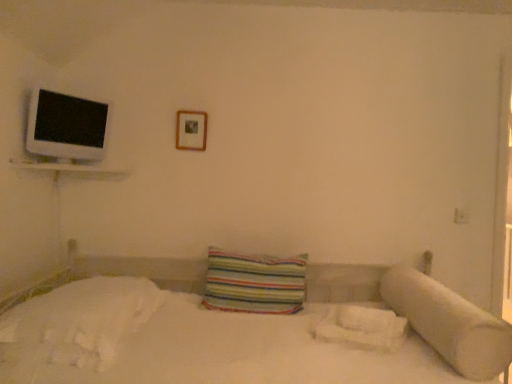
This screenshot has height=384, width=512. Find the location of `striped fabric pillow at center, the 1th pillow when ordered from left to right`. striped fabric pillow at center, the 1th pillow when ordered from left to right is located at coordinates (254, 283).

The height and width of the screenshot is (384, 512). What do you see at coordinates (254, 283) in the screenshot?
I see `striped fabric pillow at center, which is the 2th pillow in right-to-left order` at bounding box center [254, 283].

Where is `white soft bedsheet at lower left, the 1th sheet from the left`? The height and width of the screenshot is (384, 512). white soft bedsheet at lower left, the 1th sheet from the left is located at coordinates (76, 325).

Where is `white fluffy sheet at lower right, arranged as the first sheet when viewed from the right`? white fluffy sheet at lower right, arranged as the first sheet when viewed from the right is located at coordinates (362, 327).

Does point (62, 110) appear closer or farther from the camera than point (344, 326)?

Point (62, 110) appears to be farther away from the viewer than point (344, 326).

Which object is wider, white glossy flat at upper left or white fluffy sheet at lower right, arranged as the first sheet when viewed from the right?

white fluffy sheet at lower right, arranged as the first sheet when viewed from the right.

Looking at this image, from a real-world perspective, between white glossy flat at upper left and white fluffy sheet at lower right, the second sheet from the left, who is vertically higher?

From a 3D spatial view, white glossy flat at upper left is above.

Is white glossy flat at upper left aimed at white fluffy sheet at lower right, the second sheet from the left?

No, white glossy flat at upper left does not turn towards white fluffy sheet at lower right, the second sheet from the left.

In the image, is white fluffy sheet at lower right, arranged as the first sheet when viewed from the right, positioned in front of or behind white soft bedsheet at lower left, arranged as the 2th sheet when viewed from the right?

Visually, white fluffy sheet at lower right, arranged as the first sheet when viewed from the right, is located behind white soft bedsheet at lower left, arranged as the 2th sheet when viewed from the right.

From the image's perspective, which one is positioned lower, white fluffy sheet at lower right, the second sheet from the left, or white soft bedsheet at lower left, the 1th sheet from the left?

white fluffy sheet at lower right, the second sheet from the left, appears lower in the image.

Measure the distance from white fluffy sheet at lower right, the second sheet from the left, to white soft bedsheet at lower left, arranged as the 2th sheet when viewed from the right.

white fluffy sheet at lower right, the second sheet from the left, and white soft bedsheet at lower left, arranged as the 2th sheet when viewed from the right, are 3.38 feet apart.

Does white fluffy sheet at lower right, the second sheet from the left, have a smaller size compared to white soft bedsheet at lower left, arranged as the 2th sheet when viewed from the right?

Correct, white fluffy sheet at lower right, the second sheet from the left, occupies less space than white soft bedsheet at lower left, arranged as the 2th sheet when viewed from the right.

Considering the sizes of objects striped fabric pillow at center, the 1th pillow when ordered from left to right, and white soft bedsheet at lower left, arranged as the 2th sheet when viewed from the right, in the image provided, who is taller, striped fabric pillow at center, the 1th pillow when ordered from left to right, or white soft bedsheet at lower left, arranged as the 2th sheet when viewed from the right,?

striped fabric pillow at center, the 1th pillow when ordered from left to right, is taller.

Is striped fabric pillow at center, the 1th pillow when ordered from left to right, situated inside white soft bedsheet at lower left, arranged as the 2th sheet when viewed from the right, or outside?

The correct answer is: outside.

From the image's perspective, is striped fabric pillow at center, which is the 2th pillow in right-to-left order, located above white soft bedsheet at lower left, the 1th sheet from the left?

Indeed, from the image's perspective, striped fabric pillow at center, which is the 2th pillow in right-to-left order, is shown above white soft bedsheet at lower left, the 1th sheet from the left.

From a real-world perspective, between striped fabric pillow at center, which is the 2th pillow in right-to-left order, and white soft bedsheet at lower left, arranged as the 2th sheet when viewed from the right, who is vertically higher?

striped fabric pillow at center, which is the 2th pillow in right-to-left order, is physically above.

Can we say wooden picture frame at upper center lies outside white fluffy sheet at lower right, the second sheet from the left?

Yes, wooden picture frame at upper center is located beyond the bounds of white fluffy sheet at lower right, the second sheet from the left.

Is point (197, 112) more distant than point (370, 345)?

Yes, point (197, 112) is behind point (370, 345).

Are wooden picture frame at upper center and white fluffy sheet at lower right, arranged as the first sheet when viewed from the right, beside each other?

No, wooden picture frame at upper center is not with white fluffy sheet at lower right, arranged as the first sheet when viewed from the right.

Consider the image. Between wooden picture frame at upper center and white fluffy sheet at lower right, the second sheet from the left, which one has smaller size?

With smaller size is wooden picture frame at upper center.

At what (x,y) coordinates should I click in order to perform the action: click on picture frame to the right of white soft bedsheet at lower left, arranged as the 2th sheet when viewed from the right. Please return your answer as a coordinate pair (x, y). The width and height of the screenshot is (512, 384). Looking at the image, I should click on (191, 130).

Is there a large distance between white soft bedsheet at lower left, the 1th sheet from the left, and wooden picture frame at upper center?

white soft bedsheet at lower left, the 1th sheet from the left, is far away from wooden picture frame at upper center.

Does white soft bedsheet at lower left, the 1th sheet from the left, have a smaller size compared to wooden picture frame at upper center?

Actually, white soft bedsheet at lower left, the 1th sheet from the left, might be larger than wooden picture frame at upper center.

Who is smaller, white soft bedsheet at lower left, the 1th sheet from the left, or white soft pillow at right, arranged as the 1th pillow when viewed from the right?

white soft pillow at right, arranged as the 1th pillow when viewed from the right, is smaller.

Considering the positions of objects white soft bedsheet at lower left, the 1th sheet from the left, and white soft pillow at right, the 2th pillow in the left-to-right sequence, in the image provided, who is behind, white soft bedsheet at lower left, the 1th sheet from the left, or white soft pillow at right, the 2th pillow in the left-to-right sequence,?

white soft bedsheet at lower left, the 1th sheet from the left, is more distant.

From a real-world perspective, is white soft bedsheet at lower left, the 1th sheet from the left, physically located above or below white soft pillow at right, arranged as the 1th pillow when viewed from the right?

Clearly, from a real-world perspective, white soft bedsheet at lower left, the 1th sheet from the left, is below white soft pillow at right, arranged as the 1th pillow when viewed from the right.

Considering the sizes of white fluffy sheet at lower right, the second sheet from the left, and white soft pillow at right, arranged as the 1th pillow when viewed from the right, in the image, is white fluffy sheet at lower right, the second sheet from the left, bigger or smaller than white soft pillow at right, arranged as the 1th pillow when viewed from the right,?

In the image, white fluffy sheet at lower right, the second sheet from the left, appears to be smaller than white soft pillow at right, arranged as the 1th pillow when viewed from the right.

Is white fluffy sheet at lower right, arranged as the first sheet when viewed from the right, facing towards white soft pillow at right, arranged as the 1th pillow when viewed from the right?

No, white fluffy sheet at lower right, arranged as the first sheet when viewed from the right, is not facing towards white soft pillow at right, arranged as the 1th pillow when viewed from the right.

Considering the positions of point (378, 346) and point (444, 292), is point (378, 346) closer or farther from the camera than point (444, 292)?

Point (378, 346).

The width and height of the screenshot is (512, 384). Identify the location of flat above the white fluffy sheet at lower right, the second sheet from the left (from the image's perspective). (66, 126).

This screenshot has height=384, width=512. Identify the location of sheet located above the white fluffy sheet at lower right, arranged as the first sheet when viewed from the right (from a real-world perspective). (76, 325).

Estimate the real-world distances between objects in this image. Which object is closer to white soft bedsheet at lower left, arranged as the 2th sheet when viewed from the right, white glossy flat at upper left or striped fabric pillow at center, the 1th pillow when ordered from left to right?

striped fabric pillow at center, the 1th pillow when ordered from left to right, is positioned closer to the anchor white soft bedsheet at lower left, arranged as the 2th sheet when viewed from the right.

When comparing their distances from white soft pillow at right, arranged as the 1th pillow when viewed from the right, does striped fabric pillow at center, which is the 2th pillow in right-to-left order, or white soft bedsheet at lower left, the 1th sheet from the left, seem closer?

Based on the image, striped fabric pillow at center, which is the 2th pillow in right-to-left order, appears to be nearer to white soft pillow at right, arranged as the 1th pillow when viewed from the right.

Considering their positions, is white soft pillow at right, the 2th pillow in the left-to-right sequence, positioned closer to striped fabric pillow at center, which is the 2th pillow in right-to-left order, than wooden picture frame at upper center?

white soft pillow at right, the 2th pillow in the left-to-right sequence, is positioned closer to the anchor striped fabric pillow at center, which is the 2th pillow in right-to-left order.

Based on their spatial positions, is white fluffy sheet at lower right, the second sheet from the left, or white glossy flat at upper left further from striped fabric pillow at center, the 1th pillow when ordered from left to right?

The object further to striped fabric pillow at center, the 1th pillow when ordered from left to right, is white glossy flat at upper left.

Estimate the real-world distances between objects in this image. Which object is closer to white fluffy sheet at lower right, the second sheet from the left, striped fabric pillow at center, which is the 2th pillow in right-to-left order, or white soft pillow at right, the 2th pillow in the left-to-right sequence?

The object closer to white fluffy sheet at lower right, the second sheet from the left, is white soft pillow at right, the 2th pillow in the left-to-right sequence.

Which object lies further to the anchor point white fluffy sheet at lower right, the second sheet from the left, wooden picture frame at upper center or white soft pillow at right, arranged as the 1th pillow when viewed from the right?

wooden picture frame at upper center is further to white fluffy sheet at lower right, the second sheet from the left.

Which object lies nearer to the anchor point white soft bedsheet at lower left, arranged as the 2th sheet when viewed from the right, striped fabric pillow at center, which is the 2th pillow in right-to-left order, or white fluffy sheet at lower right, arranged as the first sheet when viewed from the right?

striped fabric pillow at center, which is the 2th pillow in right-to-left order, is positioned closer to the anchor white soft bedsheet at lower left, arranged as the 2th sheet when viewed from the right.

Estimate the real-world distances between objects in this image. Which object is further from white glossy flat at upper left, wooden picture frame at upper center or white soft bedsheet at lower left, arranged as the 2th sheet when viewed from the right?

white soft bedsheet at lower left, arranged as the 2th sheet when viewed from the right, is further to white glossy flat at upper left.

Find the location of a particular element. sheet situated between white soft bedsheet at lower left, arranged as the 2th sheet when viewed from the right, and white soft pillow at right, arranged as the 1th pillow when viewed from the right, from left to right is located at coordinates (362, 327).

Where is `picture frame between white soft bedsheet at lower left, the 1th sheet from the left, and white fluffy sheet at lower right, arranged as the first sheet when viewed from the right, from left to right`? The width and height of the screenshot is (512, 384). picture frame between white soft bedsheet at lower left, the 1th sheet from the left, and white fluffy sheet at lower right, arranged as the first sheet when viewed from the right, from left to right is located at coordinates (191, 130).

Locate an element on the screen. The image size is (512, 384). picture frame between white glossy flat at upper left and white soft pillow at right, the 2th pillow in the left-to-right sequence is located at coordinates (191, 130).

Find the location of a particular element. This screenshot has height=384, width=512. pillow located between white glossy flat at upper left and white fluffy sheet at lower right, the second sheet from the left, in the left-right direction is located at coordinates (254, 283).